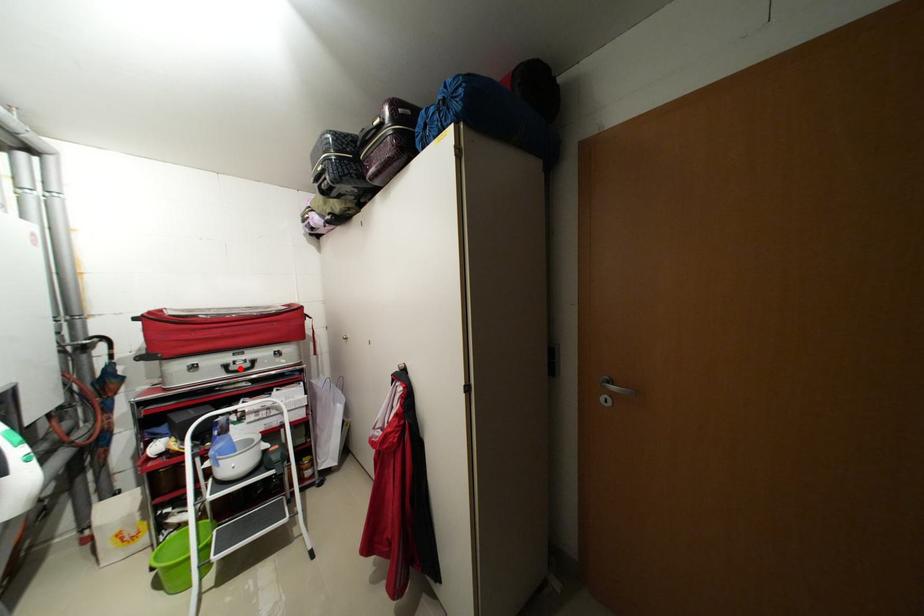
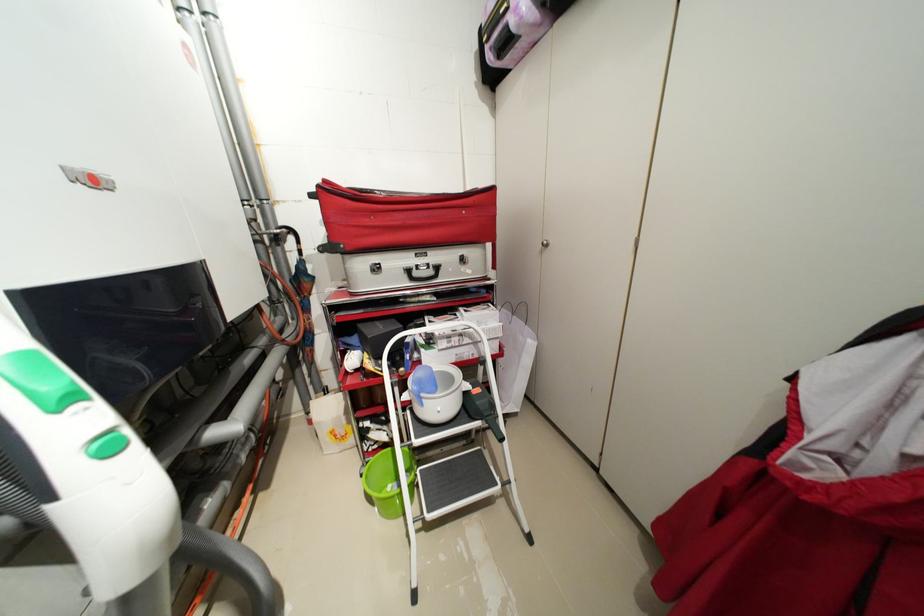
In the second image, find the point that corresponds to the highlighted location in the first image.

(422, 275)